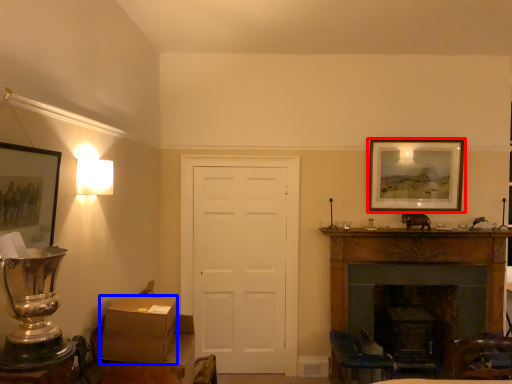
Question: Which object appears farthest to the camera in this image, picture frame (highlighted by a red box) or box (highlighted by a blue box)?

Choices:
 (A) picture frame
 (B) box

Answer: (A)